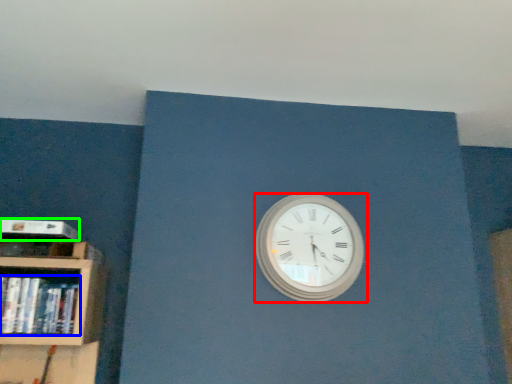
Question: Based on their relative distances, which object is nearer to wall clock (highlighted by a red box)? Choose from book (highlighted by a blue box) and paperback book (highlighted by a green box).

Choices:
 (A) book
 (B) paperback book

Answer: (A)